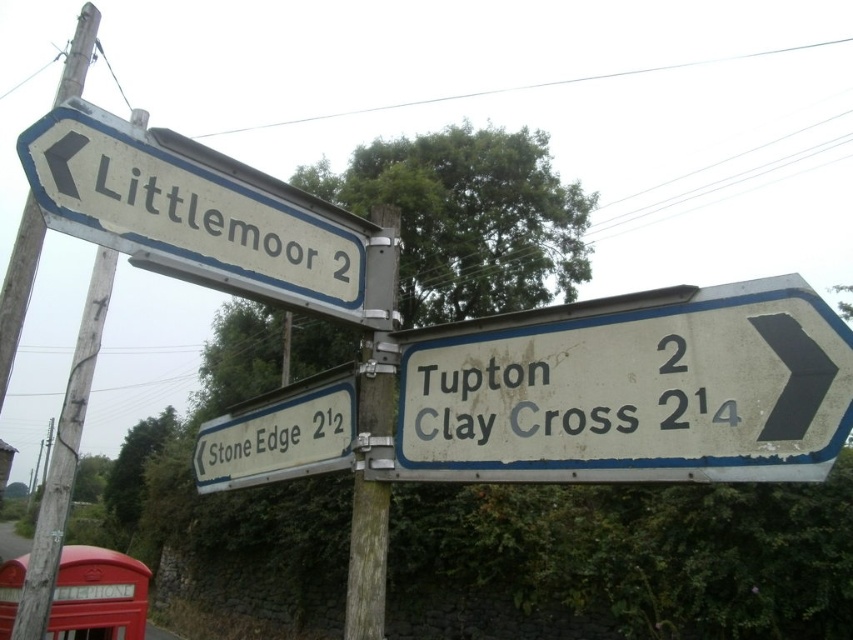
You are a delivery driver approaching the intersection and need to determine the best route. Which object, the white plastic sign at left or the wooden post at center, is located higher up on the signpost structure?

The white plastic sign at left is positioned over the wooden post at center, so it is higher up on the signpost structure.

You are a delivery driver who needs to attach a new sign to the signpost. The new sign is 1.2 meters wide. You have two options for placement next to existing signs. The white faded sign at right and the white plastic sign at lower left. Which existing sign can the new sign be placed next to without overlapping, assuming the new sign must be wider than the existing one?

The white faded sign at right might be wider than white plastic sign at lower left. Since the new sign is 1.2 meters wide and needs to be wider than the existing one, it can only be placed next to the white plastic sign at lower left if the existing sign is narrower. However, since the white faded sign at right is possibly wider, the new sign cannot be placed next to it. Therefore, the new sign should be placed next to the white plastic sign at lower left provided it is narrower than 1.2 meters.